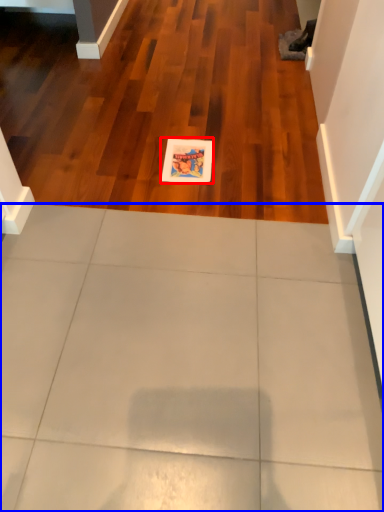
Question: Which object appears closest to the camera in this image, postcard (highlighted by a red box) or ceramic tile (highlighted by a blue box)?

Choices:
 (A) postcard
 (B) ceramic tile

Answer: (B)